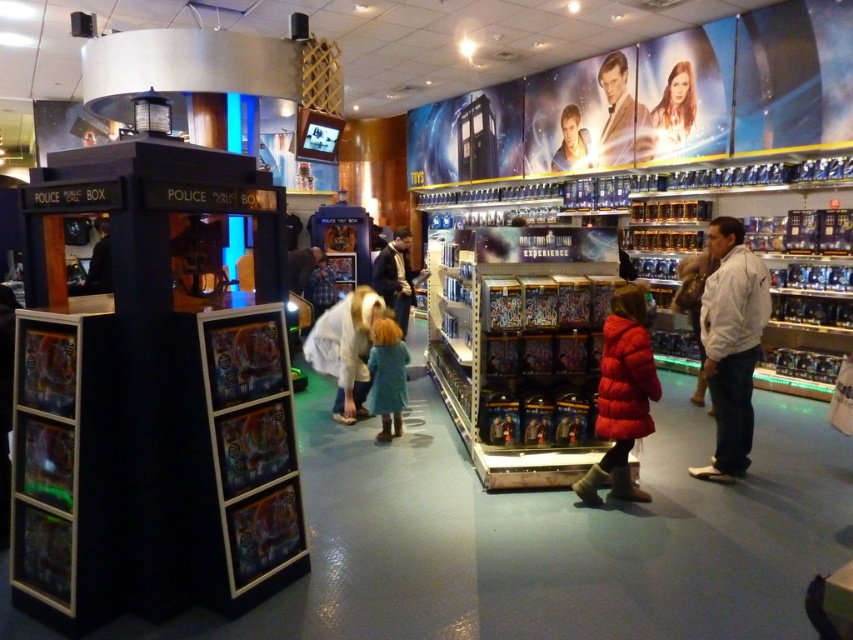
Question: Is white plush coat at center positioned in front of white cotton shirt at right?

Choices:
 (A) yes
 (B) no

Answer: (B)

Question: Considering the real-world distances, which object is farthest from the white fleece jacket at right?

Choices:
 (A) white fluffy coat at center
 (B) smooth skin face at upper right
 (C) smooth skin face at upper center

Answer: (C)

Question: Is white fluffy coat at center smaller than blue fuzzy coat at center?

Choices:
 (A) yes
 (B) no

Answer: (B)

Question: Is white plush coat at center thinner than matte black jacket at center?

Choices:
 (A) yes
 (B) no

Answer: (A)

Question: Which is nearer to the white fleece jacket at right?

Choices:
 (A) red puffy coat at center
 (B) smooth skin face at upper right
 (C) blue fuzzy coat at center

Answer: (A)

Question: Which point appears farthest from the camera in this image?

Choices:
 (A) (618, 492)
 (B) (334, 314)

Answer: (B)